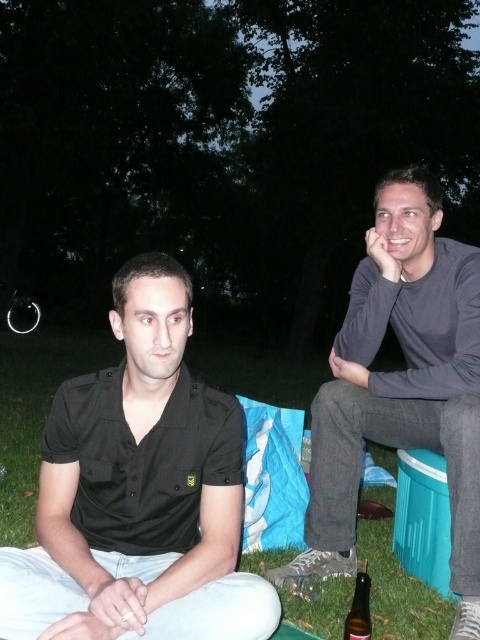
You are a photographer setting up a shot of the two people in the image. You want to ensure the gray cotton shirt at right and the brown glass bottle at lower right are both in focus. Based on their positions, which object should you focus on first to ensure both are sharp?

The gray cotton shirt at right is to the right of the brown glass bottle at lower right. Since they are positioned close to each other horizontally, focusing on the gray cotton shirt at right would likely keep both in focus as they are aligned along the same plane.

You are standing at the origin point in the image and want to move towards the gray cotton shirt at right. Which direction should you go to reach it?

The gray cotton shirt at right is located at point (x=400, y=387), so you should move northeast to reach it.